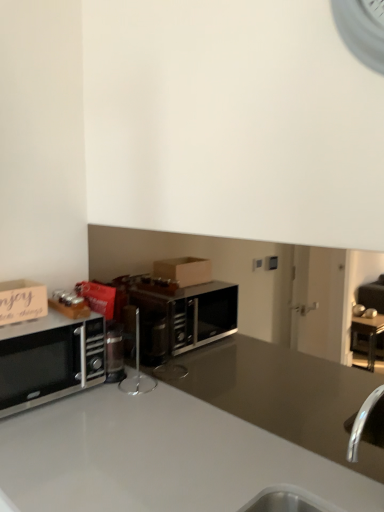
Question: Is satin black microwave at left at the back of satin silver stand at center?

Choices:
 (A) no
 (B) yes

Answer: (A)

Question: From the image's perspective, is satin silver stand at center below satin black microwave at left?

Choices:
 (A) no
 (B) yes

Answer: (A)

Question: Considering the relative positions of satin silver stand at center and satin black microwave at left in the image provided, is satin silver stand at center to the right of satin black microwave at left from the viewer's perspective?

Choices:
 (A) no
 (B) yes

Answer: (B)

Question: Is satin silver stand at center positioned beyond the bounds of satin black microwave at left?

Choices:
 (A) no
 (B) yes

Answer: (B)

Question: Could you tell me if satin silver stand at center is facing satin black microwave at left?

Choices:
 (A) yes
 (B) no

Answer: (B)

Question: In the image, is wooden sign at left positioned in front of or behind satin black microwave at left?

Choices:
 (A) behind
 (B) front

Answer: (A)

Question: Is point (41, 287) closer or farther from the camera than point (29, 354)?

Choices:
 (A) closer
 (B) farther

Answer: (A)

Question: From a real-world perspective, is wooden sign at left above or below satin black microwave at left?

Choices:
 (A) below
 (B) above

Answer: (B)

Question: Is wooden sign at left bigger or smaller than satin black microwave at left?

Choices:
 (A) small
 (B) big

Answer: (A)

Question: Visually, is satin black microwave at left positioned to the left or to the right of wooden sign at left?

Choices:
 (A) left
 (B) right

Answer: (B)

Question: Looking at their shapes, would you say satin black microwave at left is wider or thinner than wooden sign at left?

Choices:
 (A) wide
 (B) thin

Answer: (A)

Question: From a real-world perspective, relative to wooden sign at left, is satin black microwave at left vertically above or below?

Choices:
 (A) below
 (B) above

Answer: (A)

Question: From the image's perspective, is satin black microwave at left above or below wooden sign at left?

Choices:
 (A) above
 (B) below

Answer: (B)

Question: In the image, is wooden sign at left on the left side or the right side of satin silver stand at center?

Choices:
 (A) left
 (B) right

Answer: (A)

Question: In terms of height, does wooden sign at left look taller or shorter compared to satin silver stand at center?

Choices:
 (A) short
 (B) tall

Answer: (A)